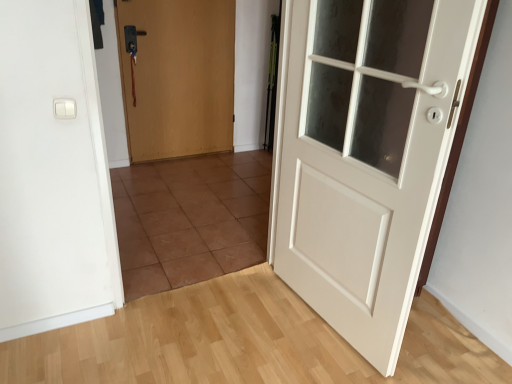
Question: Is white matte door at right, arranged as the second door when viewed from the back, taller than wooden door at center, the 2th door positioned from the right?

Choices:
 (A) yes
 (B) no

Answer: (A)

Question: Can you confirm if white matte door at right, which is the 1th door from right to left, is positioned to the left of wooden door at center, the first door viewed from the left?

Choices:
 (A) no
 (B) yes

Answer: (A)

Question: Can you confirm if white matte door at right, arranged as the second door when viewed from the back, is shorter than wooden door at center, the first door viewed from the left?

Choices:
 (A) yes
 (B) no

Answer: (B)

Question: From a real-world perspective, is white matte door at right, which is the 1th door from right to left, physically below wooden door at center, the second door from the front?

Choices:
 (A) no
 (B) yes

Answer: (A)

Question: Is white matte door at right, which ranks as the 1th door in front-to-back order, at the right side of wooden door at center, positioned as the 1th door in back-to-front order?

Choices:
 (A) no
 (B) yes

Answer: (B)

Question: From the image's perspective, is white matte door at right, which is the 1th door from right to left, over wooden door at center, positioned as the 1th door in back-to-front order?

Choices:
 (A) no
 (B) yes

Answer: (A)

Question: Does wooden door at center, the first door viewed from the left, touch white matte door at right, which is the 1th door from right to left?

Choices:
 (A) no
 (B) yes

Answer: (A)

Question: Is wooden door at center, the first door viewed from the left, positioned before white matte door at right, the 2th door when ordered from left to right?

Choices:
 (A) yes
 (B) no

Answer: (B)

Question: From a real-world perspective, is wooden door at center, the second door from the front, positioned over white matte door at right, which ranks as the 1th door in front-to-back order, based on gravity?

Choices:
 (A) no
 (B) yes

Answer: (A)

Question: Is wooden door at center, positioned as the 1th door in back-to-front order, to the right of white matte door at right, which ranks as the 1th door in front-to-back order, from the viewer's perspective?

Choices:
 (A) yes
 (B) no

Answer: (B)

Question: Is wooden door at center, the first door viewed from the left, positioned with its back to white matte door at right, arranged as the second door when viewed from the back?

Choices:
 (A) yes
 (B) no

Answer: (B)

Question: Considering the relative positions of wooden door at center, the second door from the front, and white matte door at right, arranged as the second door when viewed from the back, in the image provided, is wooden door at center, the second door from the front, to the left of white matte door at right, arranged as the second door when viewed from the back, from the viewer's perspective?

Choices:
 (A) yes
 (B) no

Answer: (A)

Question: Is white plastic light switch at upper left far away from wooden door at center, the 2th door positioned from the right?

Choices:
 (A) no
 (B) yes

Answer: (B)